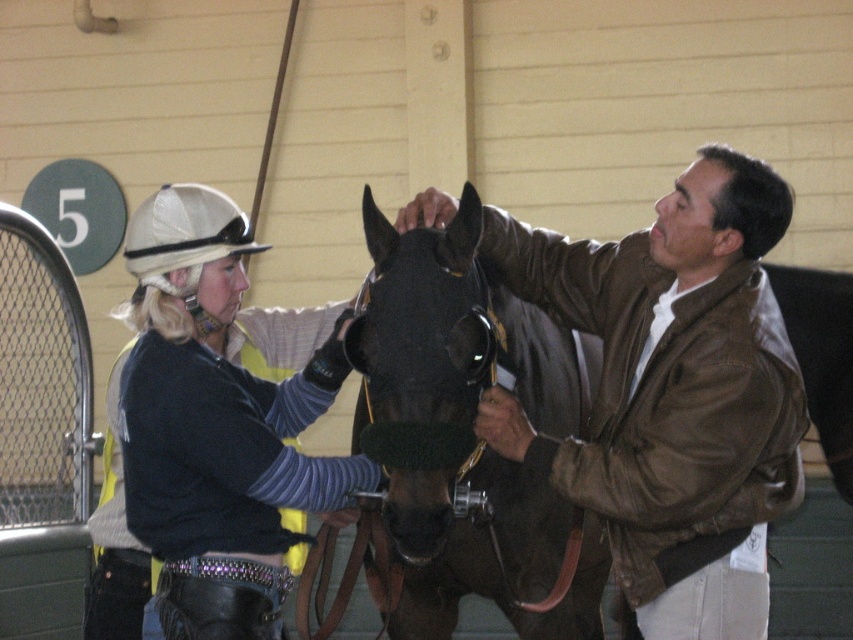
You are standing in the stable and need to locate both the brown leather jacket at center and the matte black helmet at upper left. According to their positions, which object is on the right side?

The brown leather jacket at center is positioned on the right side of the matte black helmet at upper left, so the brown leather jacket at center is on the right.

You are a photographer standing at the entrance of the stable. You want to take a photo of the brown leather jacket at center and the woman on the left. How far apart are they in the image?

The distance between the brown leather jacket at center and the woman on the left is 11.47 feet.